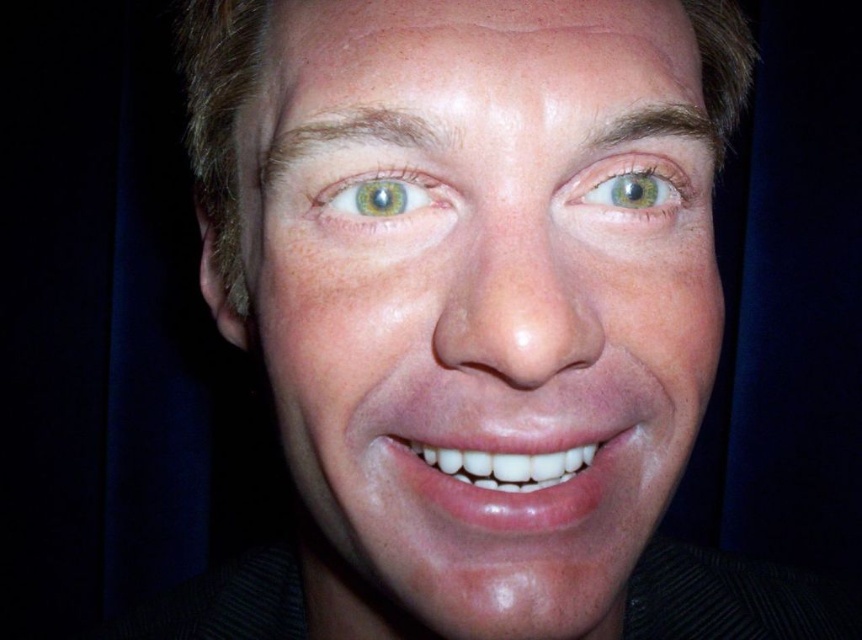
Question: Estimate the real-world distances between objects in this image. Which object is closer to the green matte eye at upper center?

Choices:
 (A) glossy white teeth at center
 (B) green matte eye at center

Answer: (B)

Question: Is smooth skin face at center behind green matte eye at center?

Choices:
 (A) yes
 (B) no

Answer: (B)

Question: Does glossy white teeth at center lie behind green matte eye at upper center?

Choices:
 (A) no
 (B) yes

Answer: (A)

Question: Which of these objects is positioned closest to the smooth skin face at center?

Choices:
 (A) green matte eye at center
 (B) glossy white teeth at center
 (C) green matte eye at upper center

Answer: (B)

Question: Among these points, which one is farthest from the camera?

Choices:
 (A) (664, 209)
 (B) (336, 67)
 (C) (534, 492)
 (D) (394, 196)

Answer: (A)

Question: Is smooth skin face at center below green matte eye at upper center?

Choices:
 (A) no
 (B) yes

Answer: (B)